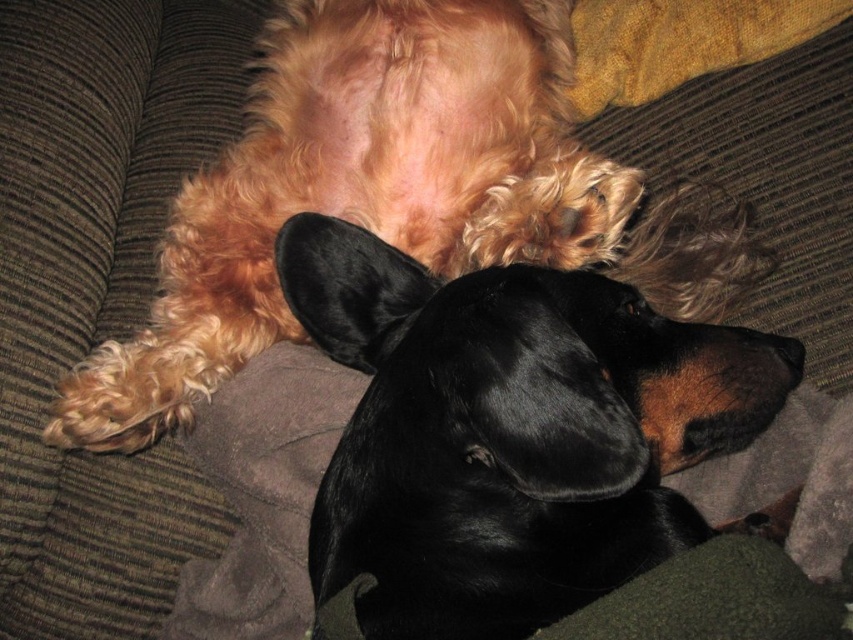
Question: Can you confirm if black shiny dog at center is thinner than fluffy golden dog at upper center?

Choices:
 (A) yes
 (B) no

Answer: (A)

Question: Is black shiny dog at center smaller than fluffy golden dog at upper center?

Choices:
 (A) no
 (B) yes

Answer: (B)

Question: Which object appears farthest from the camera in this image?

Choices:
 (A) black shiny dog at center
 (B) fluffy golden dog at upper center

Answer: (B)

Question: Which point is closer to the camera taking this photo?

Choices:
 (A) (250, 346)
 (B) (781, 378)

Answer: (B)

Question: Which of the following is the farthest from the observer?

Choices:
 (A) black shiny dog at center
 (B) fluffy golden dog at upper center

Answer: (B)

Question: Is black shiny dog at center to the right of fluffy golden dog at upper center from the viewer's perspective?

Choices:
 (A) yes
 (B) no

Answer: (A)